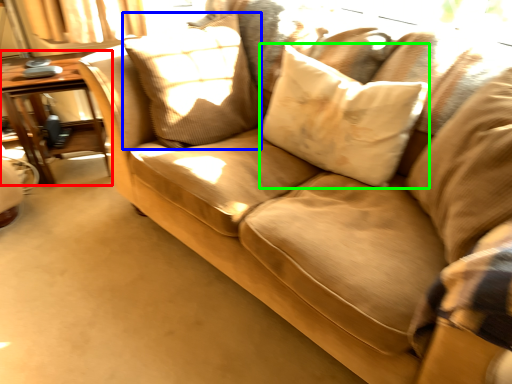
Question: Estimate the real-world distances between objects in this image. Which object is farther from table (highlighted by a red box), pillow (highlighted by a blue box) or pillow (highlighted by a green box)?

Choices:
 (A) pillow
 (B) pillow

Answer: (B)